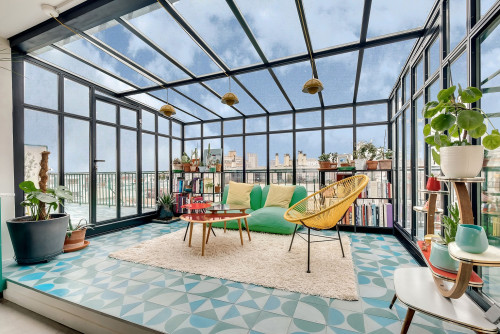
Locate an element on the screen. door handle is located at coordinates (98, 159).